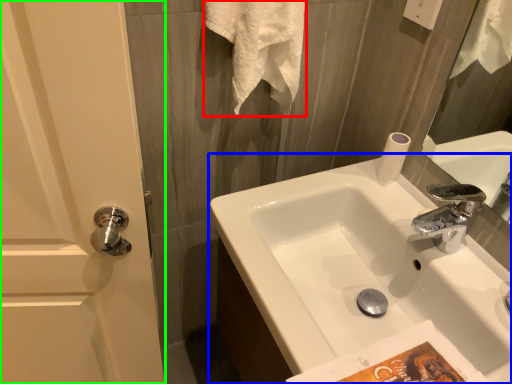
Question: Which object is the farthest from bath towel (highlighted by a red box)? Choose among these: sink (highlighted by a blue box) or screen door (highlighted by a green box).

Choices:
 (A) sink
 (B) screen door

Answer: (B)